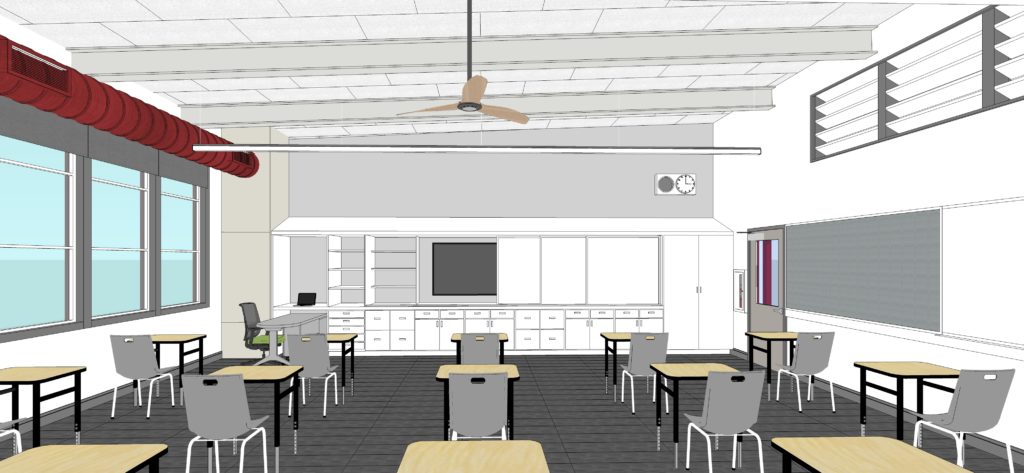
At what (x,y) coordinates should I click in order to perform the action: click on ceiling. Please return your answer as a coordinate pair (x, y). Looking at the image, I should click on (280, 68), (368, 98), (599, 44), (715, 47), (708, 91), (595, 100).